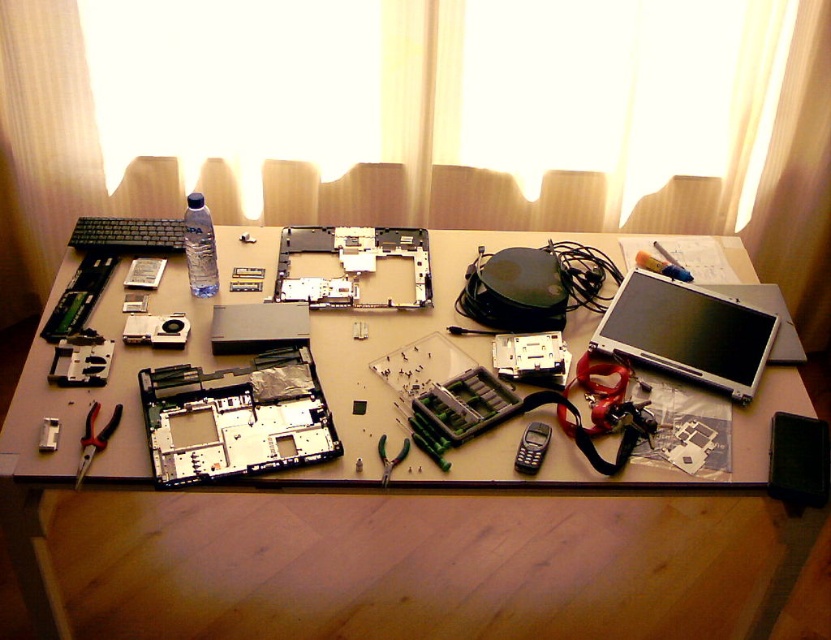
Question: Is matte plastic motherboard at center further to camera compared to metallic silver screwdriver at center-right?

Choices:
 (A) yes
 (B) no

Answer: (B)

Question: Which point appears closest to the camera in this image?

Choices:
 (A) (356, 513)
 (B) (87, 467)

Answer: (B)

Question: Which object appears closest to the camera in this image?

Choices:
 (A) metallic silver pliers at center
 (B) black plastic phone at center

Answer: (A)

Question: Can you confirm if matte plastic table at center is positioned to the left of metallic silver pliers at center?

Choices:
 (A) no
 (B) yes

Answer: (A)

Question: Is satin silver laptop at center to the left of metallic silver pliers at lower left from the viewer's perspective?

Choices:
 (A) yes
 (B) no

Answer: (B)

Question: Which object is positioned farthest from the metallic silver screwdriver at center-right?

Choices:
 (A) metallic silver pliers at center
 (B) matte silver laptop at center

Answer: (B)